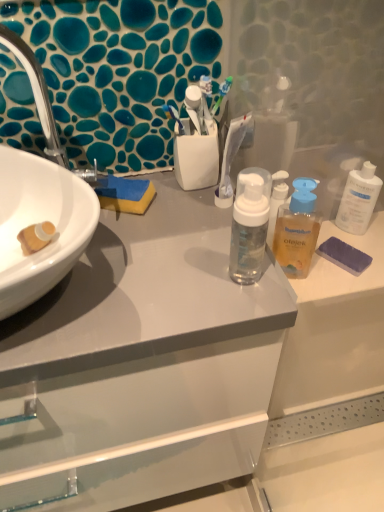
This screenshot has width=384, height=512. I want to click on blank space above white glossy cabinet at center (from a real-world perspective), so click(x=145, y=239).